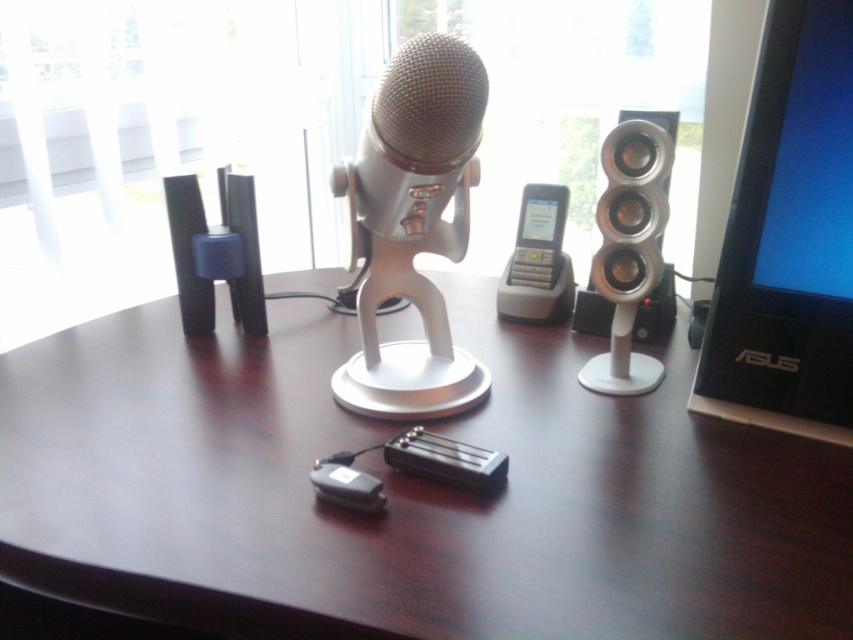
Is point (732, 380) behind point (173, 209)?

No, (732, 380) is in front of (173, 209).

Describe the element at coordinates (788, 237) in the screenshot. This screenshot has height=640, width=853. I see `black plastic monitor at upper right` at that location.

Where is `black plastic monitor at upper right`? black plastic monitor at upper right is located at coordinates (788, 237).

Who is taller, dark wood table at center or black plastic speaker at left?

dark wood table at center is taller.

Which is above, dark wood table at center or black plastic speaker at left?

black plastic speaker at left

Identify the location of dark wood table at center. (405, 492).

Locate an element on the screen. This screenshot has width=853, height=640. dark wood table at center is located at coordinates (405, 492).

Who is taller, silver metallic microphone at center or silver metallic speaker at right?

silver metallic microphone at center is taller.

Does point (398, 80) come farther from viewer compared to point (640, 300)?

No, it is in front of (640, 300).

The height and width of the screenshot is (640, 853). I want to click on silver metallic microphone at center, so click(x=413, y=227).